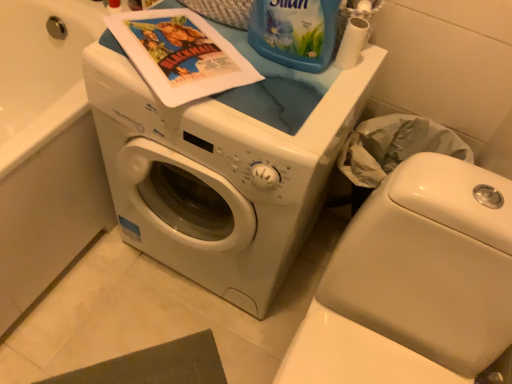
In order to click on vacant area that lies in front of white glossy washing machine at center in this screenshot , I will do `click(161, 339)`.